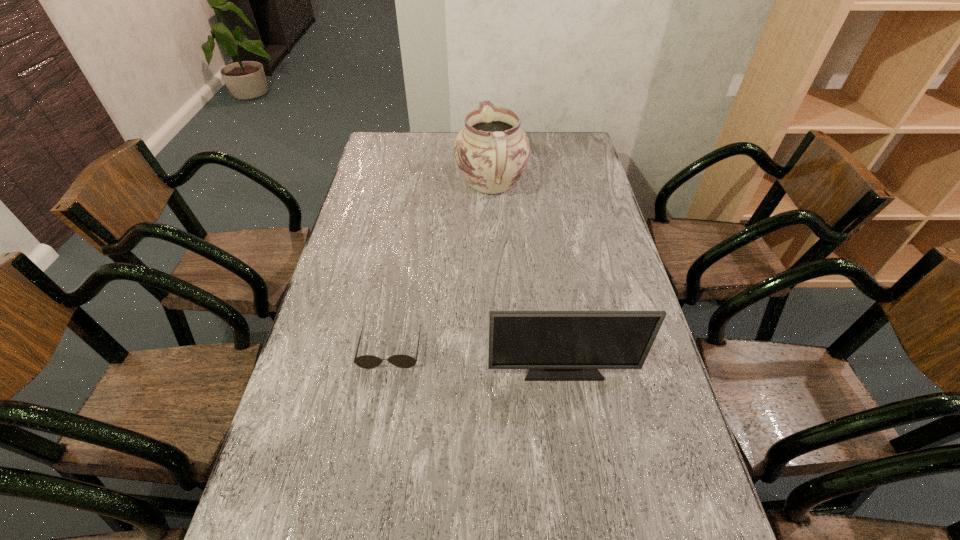
Identify the location of pitcher. (492, 151).

Find the location of a particular element. The image size is (960, 540). monitor is located at coordinates (554, 345).

Where is `sunglasses`? sunglasses is located at coordinates (366, 361).

In order to click on the shortest object in this screenshot , I will do `click(366, 361)`.

Identify the location of vacant space located on the spout of the pitcher. (491, 153).

At what (x,y) coordinates should I click in order to perform the action: click on free location located 0.230m on the spout of the pitcher. Please return your answer as a coordinate pair (x, y). The height and width of the screenshot is (540, 960). Looking at the image, I should click on (490, 133).

The height and width of the screenshot is (540, 960). In order to click on vacant region located on the spout of the pitcher in this screenshot , I will do `click(491, 153)`.

Where is `vacant space located on the screen side of the monitor`? vacant space located on the screen side of the monitor is located at coordinates (570, 418).

Image resolution: width=960 pixels, height=540 pixels. What are the coordinates of `blank area located on the front-facing side of the shortest object` in the screenshot? It's located at (369, 479).

Identify the location of object that is at the far edge. The height and width of the screenshot is (540, 960). (492, 151).